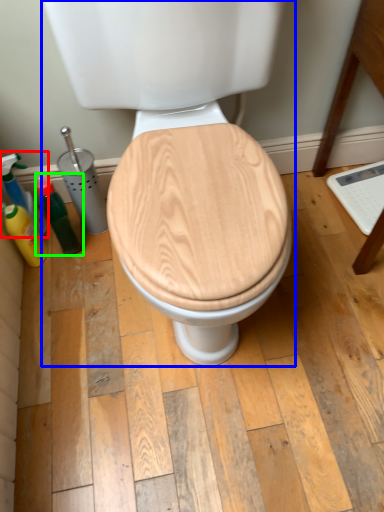
Question: Which is farther away from cleaning product (highlighted by a red box)? toilet (highlighted by a blue box) or bottle (highlighted by a green box)?

Choices:
 (A) toilet
 (B) bottle

Answer: (A)